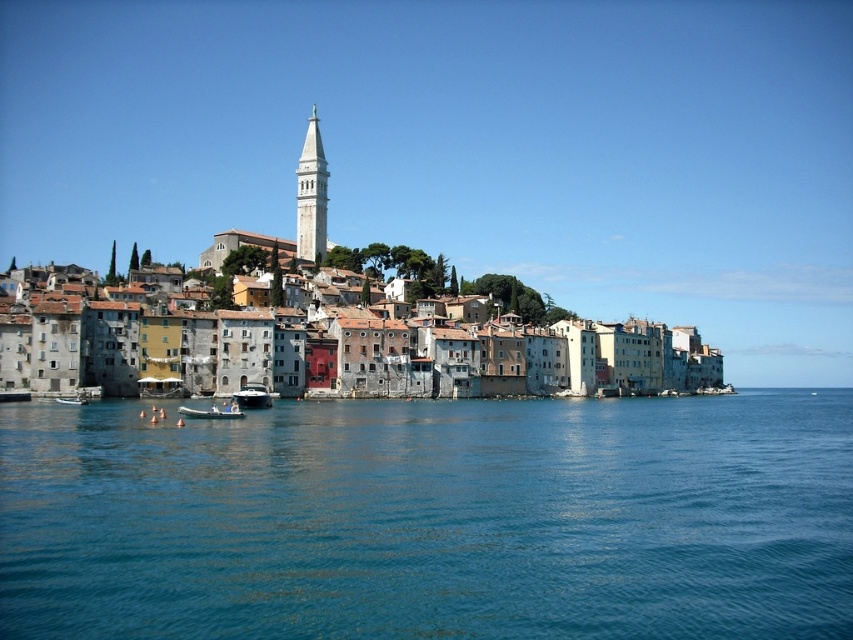
Question: Which object is the closest to the multicolored stone buildings at center?

Choices:
 (A) white glossy boat at center
 (B) green rubber dinghy at lower center

Answer: (A)

Question: Which point is farther to the camera?

Choices:
 (A) click(834, 413)
 (B) click(326, 164)
 (C) click(73, 401)
 (D) click(252, 404)

Answer: (B)

Question: Is blue water at center thinner than white plastic boat at lower left?

Choices:
 (A) yes
 (B) no

Answer: (B)

Question: Considering the relative positions of multicolored stone buildings at center and green rubber dinghy at lower center in the image provided, where is multicolored stone buildings at center located with respect to green rubber dinghy at lower center?

Choices:
 (A) right
 (B) left

Answer: (B)

Question: Is blue water at center smaller than white plastic boat at lower left?

Choices:
 (A) yes
 (B) no

Answer: (B)

Question: Which object appears farthest from the camera in this image?

Choices:
 (A) white stone bell tower at upper center
 (B) green rubber dinghy at lower center
 (C) multicolored stone buildings at center
 (D) blue water at center

Answer: (A)